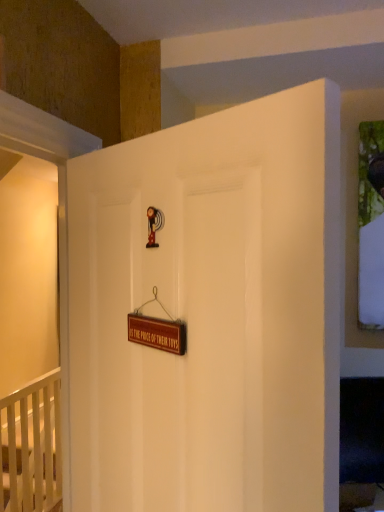
Question: Looking at the image, does brown wooden sign at center seem bigger or smaller compared to white wooden crib at lower left?

Choices:
 (A) small
 (B) big

Answer: (A)

Question: Do you think brown wooden sign at center is within white wooden crib at lower left, or outside of it?

Choices:
 (A) outside
 (B) inside

Answer: (A)

Question: Which of these objects is positioned closest to the white matte door at center?

Choices:
 (A) white wooden crib at lower left
 (B) brown wooden sign at center

Answer: (B)

Question: Which object is the closest to the white wooden crib at lower left?

Choices:
 (A) white matte door at center
 (B) brown wooden sign at center

Answer: (A)